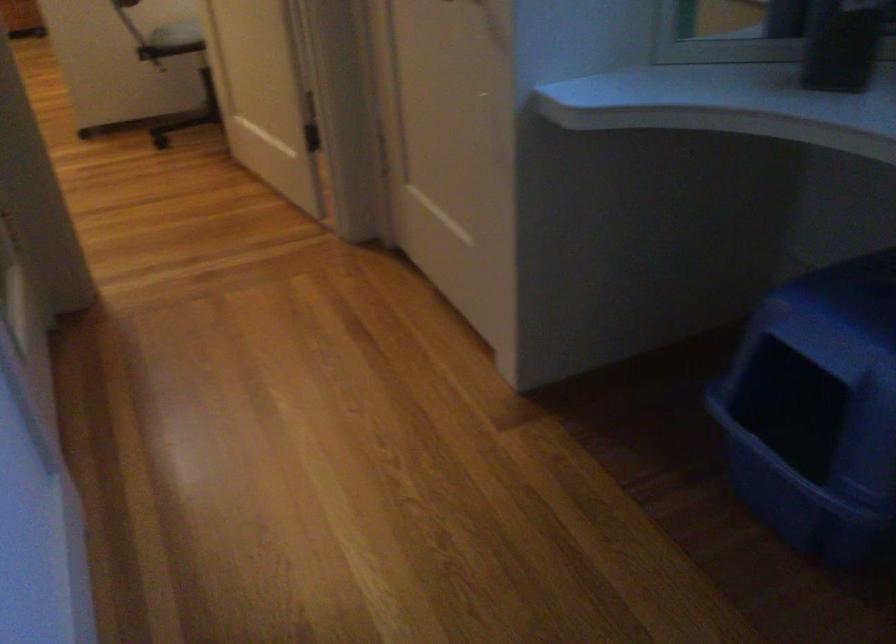
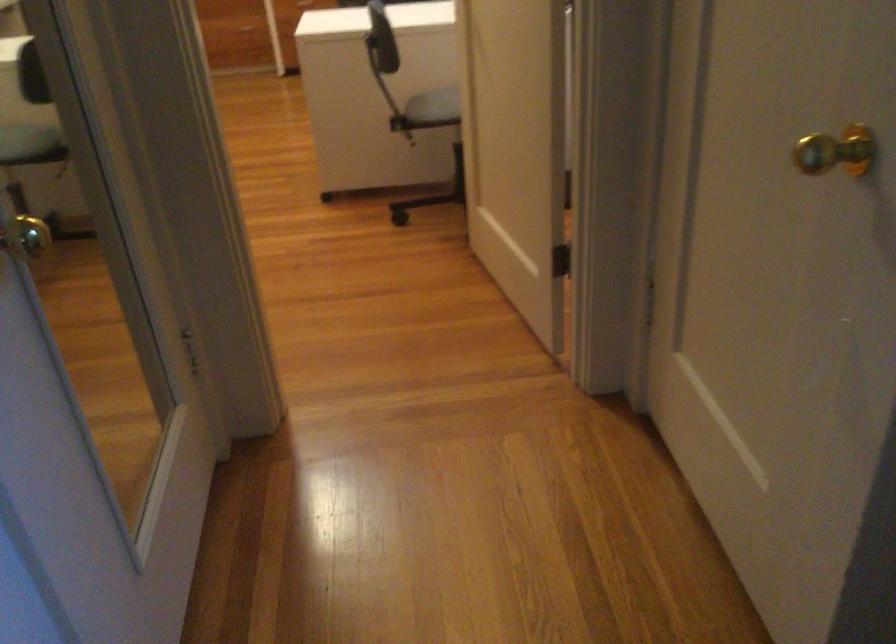
Question: Which direction would the cameraman need to move to produce the second image? Reply with the corresponding letter.

Choices:
 (A) Left
 (B) Right
 (C) Forward
 (D) Backward

Answer: (C)